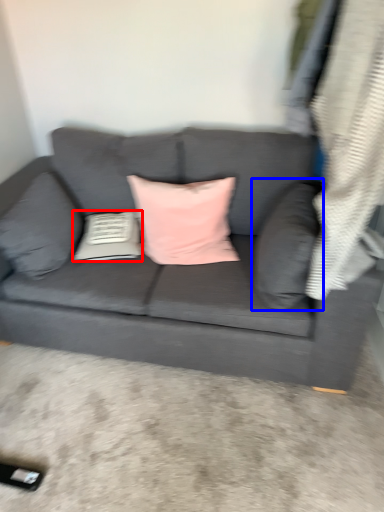
Question: Which object is further to the camera taking this photo, pillow (highlighted by a red box) or pillow (highlighted by a blue box)?

Choices:
 (A) pillow
 (B) pillow

Answer: (A)